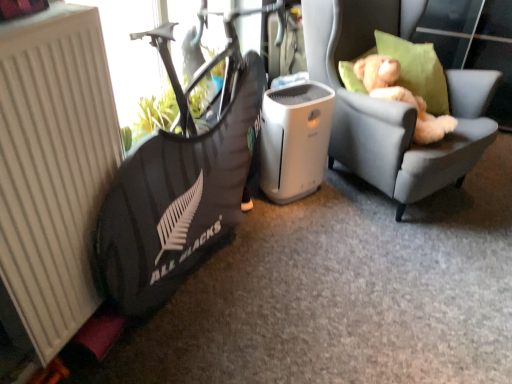
The height and width of the screenshot is (384, 512). What do you see at coordinates (52, 171) in the screenshot?
I see `white matte radiator at left` at bounding box center [52, 171].

From the picture: In order to face light gray fabric chair at right, should I rotate leftwards or rightwards?

Turn right by 19.189 degrees to look at light gray fabric chair at right.

What is the approximate width of white plastic air purifier at center?

The width of white plastic air purifier at center is 24.84 centimeters.

Measure the distance between point (294, 146) and camera.

The distance of point (294, 146) from camera is 2.00 meters.

Describe the element at coordinates (401, 96) in the screenshot. I see `light brown plush teddy bear at upper right` at that location.

Locate an element on the screen. This screenshot has width=512, height=384. white matte radiator at left is located at coordinates (52, 171).

How many degrees apart are the facing directions of light gray fabric chair at right and light brown plush teddy bear at upper right?

The angular difference between light gray fabric chair at right and light brown plush teddy bear at upper right is 8.16 degrees.

From a real-world perspective, relative to light brown plush teddy bear at upper right, is light gray fabric chair at right vertically above or below?

light gray fabric chair at right is below light brown plush teddy bear at upper right.

The width and height of the screenshot is (512, 384). In order to click on animal lying on the left of light gray fabric chair at right in this screenshot , I will do `click(401, 96)`.

Is light brown plush teddy bear at upper right surrounded by light gray fabric chair at right?

Indeed, light brown plush teddy bear at upper right is located within light gray fabric chair at right.

Measure the distance between light gray fabric chair at right and white plastic air purifier at center.

13.40 inches.

Is point (404, 160) positioned before point (320, 142)?

That is True.

Between light gray fabric chair at right and white plastic air purifier at center, which one has less height?

Standing shorter between the two is white plastic air purifier at center.

Is light gray fabric chair at right to the left of white plastic air purifier at center from the viewer's perspective?

Incorrect, light gray fabric chair at right is not on the left side of white plastic air purifier at center.

Would you say white matte radiator at left is inside or outside black fabric bean bag chair at left?

white matte radiator at left is not inside black fabric bean bag chair at left, it's outside.

Is white matte radiator at left positioned far away from black fabric bean bag chair at left?

No, there isn't a large distance between white matte radiator at left and black fabric bean bag chair at left.

Considering the relative positions of white matte radiator at left and black fabric bean bag chair at left in the image provided, is white matte radiator at left to the left of black fabric bean bag chair at left from the viewer's perspective?

Yes, white matte radiator at left is to the left of black fabric bean bag chair at left.

The image size is (512, 384). I want to click on radiator on the left side of black fabric bean bag chair at left, so click(52, 171).

Based on the photo, which is closer to the camera, (20, 71) or (397, 74)?

Point (20, 71) appears to be closer to the viewer than point (397, 74).

Is white matte radiator at left further to the viewer compared to light brown plush teddy bear at upper right?

No.

In terms of width, does white matte radiator at left look wider or thinner when compared to light brown plush teddy bear at upper right?

Considering their sizes, white matte radiator at left looks slimmer than light brown plush teddy bear at upper right.

Identify the location of animal on the right side of black fabric bean bag chair at left. (401, 96).

Are black fabric bean bag chair at left and light brown plush teddy bear at upper right making contact?

No, black fabric bean bag chair at left is not touching light brown plush teddy bear at upper right.

Does black fabric bean bag chair at left have a larger size compared to light brown plush teddy bear at upper right?

Indeed, black fabric bean bag chair at left has a larger size compared to light brown plush teddy bear at upper right.

Relative to light brown plush teddy bear at upper right, is black fabric bean bag chair at left in front or behind?

Clearly, black fabric bean bag chair at left is in front of light brown plush teddy bear at upper right.

From a real-world perspective, who is located lower, light gray fabric chair at right or black fabric bean bag chair at left?

black fabric bean bag chair at left is physically lower.

How different are the orientations of light gray fabric chair at right and black fabric bean bag chair at left in degrees?

There is a 36.4-degree angle between the facing directions of light gray fabric chair at right and black fabric bean bag chair at left.

From the image's perspective, which one is positioned higher, light gray fabric chair at right or black fabric bean bag chair at left?

light gray fabric chair at right.

Is light gray fabric chair at right not close to black fabric bean bag chair at left?

light gray fabric chair at right is near black fabric bean bag chair at left, not far away.

What's the angular difference between light brown plush teddy bear at upper right and white matte radiator at left's facing directions?

25.3 degrees.

Considering the positions of objects light brown plush teddy bear at upper right and white matte radiator at left in the image provided, who is in front, light brown plush teddy bear at upper right or white matte radiator at left?

white matte radiator at left is closer to the camera.

Consider the image. From a real-world perspective, is light brown plush teddy bear at upper right under white matte radiator at left?

Yes, from a real-world perspective, light brown plush teddy bear at upper right is beneath white matte radiator at left.

Between light brown plush teddy bear at upper right and white matte radiator at left, which one appears on the left side from the viewer's perspective?

From the viewer's perspective, white matte radiator at left appears more on the left side.

This screenshot has width=512, height=384. Find the location of `chair beneath the light brown plush teddy bear at upper right (from a real-world perspective)`. chair beneath the light brown plush teddy bear at upper right (from a real-world perspective) is located at coordinates [392, 105].

Locate an element on the screen. Image resolution: width=512 pixels, height=384 pixels. appliance that appears below the light gray fabric chair at right (from the image's perspective) is located at coordinates (294, 140).

Based on their spatial positions, is white matte radiator at left or light brown plush teddy bear at upper right closer to white plastic air purifier at center?

light brown plush teddy bear at upper right is positioned closer to the anchor white plastic air purifier at center.

Considering their positions, is black fabric bean bag chair at left positioned further to white plastic air purifier at center than white matte radiator at left?

white matte radiator at left is positioned further to the anchor white plastic air purifier at center.

Which object lies further to the anchor point light gray fabric chair at right, light brown plush teddy bear at upper right or white plastic air purifier at center?

white plastic air purifier at center lies further to light gray fabric chair at right than the other object.

Which object lies nearer to the anchor point white plastic air purifier at center, white matte radiator at left or light gray fabric chair at right?

light gray fabric chair at right is positioned closer to the anchor white plastic air purifier at center.

Looking at the image, which one is located closer to white matte radiator at left, light brown plush teddy bear at upper right or light gray fabric chair at right?

light gray fabric chair at right is closer to white matte radiator at left.

Based on their spatial positions, is white plastic air purifier at center or black fabric bean bag chair at left further from light gray fabric chair at right?

Based on the image, black fabric bean bag chair at left appears to be further to light gray fabric chair at right.

Estimate the real-world distances between objects in this image. Which object is further from white matte radiator at left, light brown plush teddy bear at upper right or black fabric bean bag chair at left?

Based on the image, light brown plush teddy bear at upper right appears to be further to white matte radiator at left.

Estimate the real-world distances between objects in this image. Which object is further from light brown plush teddy bear at upper right, black fabric bean bag chair at left or white matte radiator at left?

Based on the image, white matte radiator at left appears to be further to light brown plush teddy bear at upper right.

You are a GUI agent. You are given a task and a screenshot of the screen. Output one action in this format:
    pyautogui.click(x=<x>, y=<y>)
    Task: Click on the animal positioned between white matte radiator at left and white plastic air purifier at center from near to far
    This screenshot has width=512, height=384.
    Given the screenshot: What is the action you would take?
    pyautogui.click(x=401, y=96)

Find the location of a particular element. This screenshot has width=512, height=384. chair located between black fabric bean bag chair at left and white plastic air purifier at center in the depth direction is located at coordinates (392, 105).

You are a GUI agent. You are given a task and a screenshot of the screen. Output one action in this format:
    pyautogui.click(x=<x>, y=<y>)
    Task: Click on the animal located between black fabric bean bag chair at left and white plastic air purifier at center in the depth direction
    Image resolution: width=512 pixels, height=384 pixels.
    Given the screenshot: What is the action you would take?
    pyautogui.click(x=401, y=96)

This screenshot has height=384, width=512. In order to click on animal situated between white plastic air purifier at center and light gray fabric chair at right from left to right in this screenshot , I will do `click(401, 96)`.